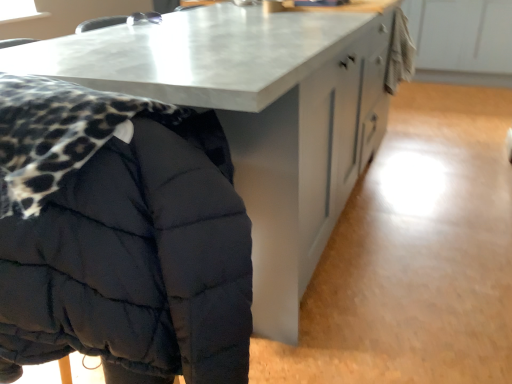
Describe the element at coordinates (256, 116) in the screenshot. I see `matte gray table at center` at that location.

Where is `matte gray table at center`? matte gray table at center is located at coordinates (256, 116).

At what (x,y) coordinates should I click in order to perform the action: click on quilted black jacket at left. Please return your answer as a coordinate pair (x, y). The image size is (512, 384). Looking at the image, I should click on (118, 239).

Describe the element at coordinates (118, 239) in the screenshot. This screenshot has height=384, width=512. I see `quilted black jacket at left` at that location.

Measure the distance between quilted black jacket at left and camera.

The depth of quilted black jacket at left is 23.63 inches.

Where is `matte gray table at center`? matte gray table at center is located at coordinates (256, 116).

Considering the relative positions of quilted black jacket at left and matte gray table at center in the image provided, is quilted black jacket at left to the left of matte gray table at center from the viewer's perspective?

Yes, quilted black jacket at left is to the left of matte gray table at center.

Is quilted black jacket at left in front of or behind matte gray table at center in the image?

Visually, quilted black jacket at left is located in front of matte gray table at center.

Which is in front, point (110, 271) or point (69, 49)?

The point (110, 271) is more forward.

From the image's perspective, which one is positioned lower, quilted black jacket at left or matte gray table at center?

quilted black jacket at left.

From a real-world perspective, is quilted black jacket at left on top of matte gray table at center?

Yes, from a real-world perspective, quilted black jacket at left is above matte gray table at center.

Does quilted black jacket at left have a lesser width compared to matte gray table at center?

Yes.

Considering the relative sizes of quilted black jacket at left and matte gray table at center in the image provided, is quilted black jacket at left taller than matte gray table at center?

Indeed, quilted black jacket at left has a greater height compared to matte gray table at center.

Considering the sizes of objects quilted black jacket at left and matte gray table at center in the image provided, who is smaller, quilted black jacket at left or matte gray table at center?

Smaller between the two is quilted black jacket at left.

Is quilted black jacket at left located outside matte gray table at center?

Actually, quilted black jacket at left is at least partially inside matte gray table at center.

Is quilted black jacket at left not near matte gray table at center?

They are positioned close to each other.

Is quilted black jacket at left oriented towards matte gray table at center?

Yes, quilted black jacket at left is turned towards matte gray table at center.

Can you tell me how much quilted black jacket at left and matte gray table at center differ in facing direction?

89.2 degrees separate the facing orientations of quilted black jacket at left and matte gray table at center.

Measure the distance from quilted black jacket at left to matte gray table at center.

quilted black jacket at left and matte gray table at center are 17.16 inches apart.

Where is `jacket in front of the matte gray table at center`? The image size is (512, 384). jacket in front of the matte gray table at center is located at coordinates (118, 239).

Based on their positions, is matte gray table at center located to the left or right of quilted black jacket at left?

Based on their positions, matte gray table at center is located to the right of quilted black jacket at left.

Considering the relative positions of matte gray table at center and quilted black jacket at left in the image provided, is matte gray table at center in front of quilted black jacket at left?

No, matte gray table at center is further to the viewer.

Considering the points (282, 40) and (36, 145), which point is behind, point (282, 40) or point (36, 145)?

The point (282, 40) is behind.

From the image's perspective, is matte gray table at center above or below quilted black jacket at left?

Based on their image positions, matte gray table at center is located above quilted black jacket at left.

From a real-world perspective, is matte gray table at center located higher than quilted black jacket at left?

No, from a real-world perspective, matte gray table at center is not on top of quilted black jacket at left.

Considering the relative sizes of matte gray table at center and quilted black jacket at left in the image provided, is matte gray table at center thinner than quilted black jacket at left?

In fact, matte gray table at center might be wider than quilted black jacket at left.

Can you confirm if matte gray table at center is taller than quilted black jacket at left?

No, matte gray table at center is not taller than quilted black jacket at left.

Considering the sizes of objects matte gray table at center and quilted black jacket at left in the image provided, who is bigger, matte gray table at center or quilted black jacket at left?

matte gray table at center is bigger.

Would you say matte gray table at center is inside or outside quilted black jacket at left?

A: matte gray table at center exists outside the volume of quilted black jacket at left.

Is matte gray table at center beside quilted black jacket at left?

They are not placed beside each other.

Is matte gray table at center turned away from quilted black jacket at left?

matte gray table at center is not turned away from quilted black jacket at left.

How many degrees apart are the facing directions of matte gray table at center and quilted black jacket at left?

The angular difference between matte gray table at center and quilted black jacket at left is 89.2 degrees.

Locate an element on the screen. This screenshot has width=512, height=384. table that appears below the quilted black jacket at left (from a real-world perspective) is located at coordinates (256, 116).

Locate an element on the screen. Image resolution: width=512 pixels, height=384 pixels. table on the right of quilted black jacket at left is located at coordinates (256, 116).

Locate an element on the screen. The height and width of the screenshot is (384, 512). jacket lying on the left of matte gray table at center is located at coordinates (118, 239).